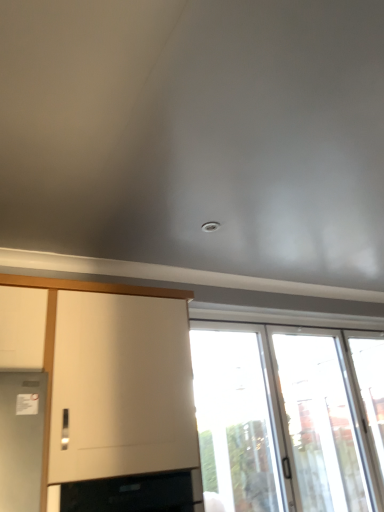
Question: From a real-world perspective, is transparent glass window at lower right, which ranks as the 2th window in right-to-left order, physically above black glass oven at lower left?

Choices:
 (A) yes
 (B) no

Answer: (A)

Question: Are transparent glass window at lower right, which ranks as the 2th window in right-to-left order, and black glass oven at lower left located far from each other?

Choices:
 (A) yes
 (B) no

Answer: (A)

Question: Can you confirm if transparent glass window at lower right, which ranks as the 2th window in right-to-left order, is positioned to the left of black glass oven at lower left?

Choices:
 (A) no
 (B) yes

Answer: (A)

Question: Can you confirm if transparent glass window at lower right, which ranks as the 2th window in right-to-left order, is shorter than black glass oven at lower left?

Choices:
 (A) no
 (B) yes

Answer: (A)

Question: From a real-world perspective, is transparent glass window at lower right, which ranks as the 2th window in right-to-left order, physically below black glass oven at lower left?

Choices:
 (A) yes
 (B) no

Answer: (B)

Question: Is transparent glass window at lower right, which ranks as the 2th window in right-to-left order, thinner than black glass oven at lower left?

Choices:
 (A) no
 (B) yes

Answer: (B)

Question: Is transparent glass screen door at right closer to the viewer compared to black glass oven at lower left?

Choices:
 (A) yes
 (B) no

Answer: (B)

Question: Considering the relative sizes of transparent glass screen door at right and black glass oven at lower left in the image provided, is transparent glass screen door at right wider than black glass oven at lower left?

Choices:
 (A) yes
 (B) no

Answer: (B)

Question: Is black glass oven at lower left surrounded by transparent glass screen door at right?

Choices:
 (A) no
 (B) yes

Answer: (A)

Question: Is transparent glass screen door at right to the left of black glass oven at lower left from the viewer's perspective?

Choices:
 (A) no
 (B) yes

Answer: (A)

Question: Does transparent glass screen door at right have a larger size compared to black glass oven at lower left?

Choices:
 (A) yes
 (B) no

Answer: (A)

Question: Is transparent glass screen door at right thinner than black glass oven at lower left?

Choices:
 (A) no
 (B) yes

Answer: (B)

Question: Does transparent glass window at lower right, the 1th window in the left-to-right sequence, have a smaller size compared to transparent glass door at right, positioned as the first window in right-to-left order?

Choices:
 (A) no
 (B) yes

Answer: (A)